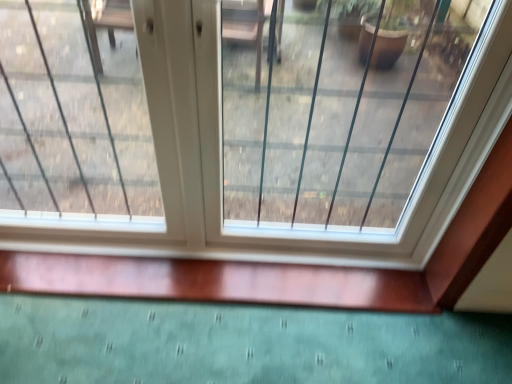
Question: Is clear glass window at center facing towards transparent glass window at center?

Choices:
 (A) yes
 (B) no

Answer: (A)

Question: From a real-world perspective, is clear glass window at center over transparent glass window at center?

Choices:
 (A) no
 (B) yes

Answer: (B)

Question: From the image's perspective, is clear glass window at center under transparent glass window at center?

Choices:
 (A) no
 (B) yes

Answer: (A)

Question: From a real-world perspective, is clear glass window at center below transparent glass window at center?

Choices:
 (A) yes
 (B) no

Answer: (B)

Question: Does clear glass window at center have a larger size compared to transparent glass window at center?

Choices:
 (A) no
 (B) yes

Answer: (B)

Question: Can you confirm if clear glass window at center is thinner than transparent glass window at center?

Choices:
 (A) no
 (B) yes

Answer: (A)

Question: Can you confirm if transparent glass window at center is positioned to the right of clear glass window at center?

Choices:
 (A) yes
 (B) no

Answer: (B)

Question: From a real-world perspective, is transparent glass window at center positioned under clear glass window at center based on gravity?

Choices:
 (A) no
 (B) yes

Answer: (B)

Question: Does transparent glass window at center have a lesser width compared to clear glass window at center?

Choices:
 (A) yes
 (B) no

Answer: (A)

Question: Can you confirm if transparent glass window at center is bigger than clear glass window at center?

Choices:
 (A) no
 (B) yes

Answer: (A)

Question: Does transparent glass window at center appear on the left side of clear glass window at center?

Choices:
 (A) yes
 (B) no

Answer: (A)

Question: From the image's perspective, is transparent glass window at center below clear glass window at center?

Choices:
 (A) no
 (B) yes

Answer: (B)

Question: From the image's perspective, is clear glass window at center located above or below transparent glass window at center?

Choices:
 (A) below
 (B) above

Answer: (B)